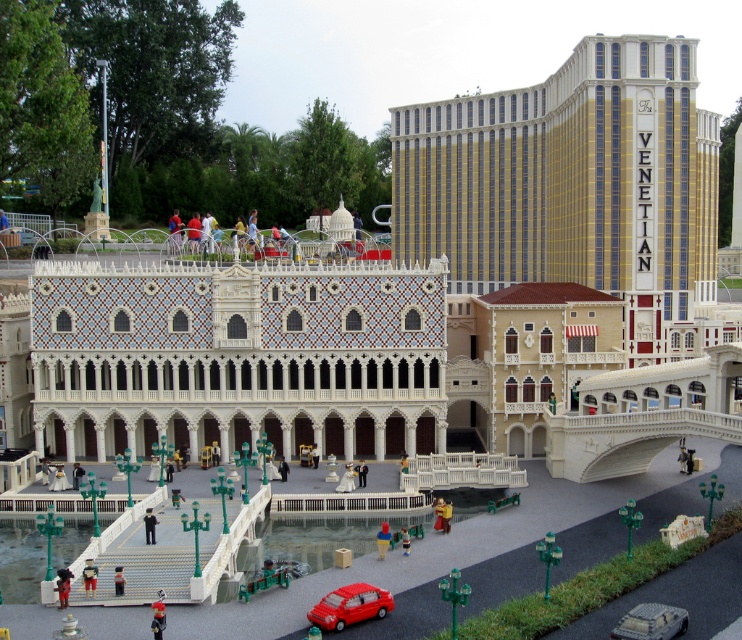
Between matte red car at lower center and black fabric person at center, which one is positioned higher?

Positioned higher is black fabric person at center.

Is point (653, 609) more distant than point (147, 541)?

That is False.

Locate an element on the screen. matte red car at lower center is located at coordinates (651, 621).

From the picture: Between dark red fabric dress at lower left and black fabric person at center, which one is positioned lower?

dark red fabric dress at lower left is lower down.

Can you confirm if dark red fabric dress at lower left is taller than black fabric person at center?

In fact, dark red fabric dress at lower left may be shorter than black fabric person at center.

Does point (68, 577) lie in front of point (151, 516)?

Yes, it is in front of point (151, 516).

Identify the location of dark red fabric dress at lower left. (62, 586).

Between gold mosaic hotel at upper right and matte red car at lower center, which one is positioned higher?

gold mosaic hotel at upper right is higher up.

Is gold mosaic hotel at upper right positioned before matte red car at lower center?

No, gold mosaic hotel at upper right is behind matte red car at lower center.

Is point (418, 212) positioned in front of point (613, 637)?

No, (418, 212) is further to viewer.

At what (x,y) coordinates should I click in order to perform the action: click on gold mosaic hotel at upper right. Please return your answer as a coordinate pair (x, y). The image size is (742, 640). Looking at the image, I should click on (568, 179).